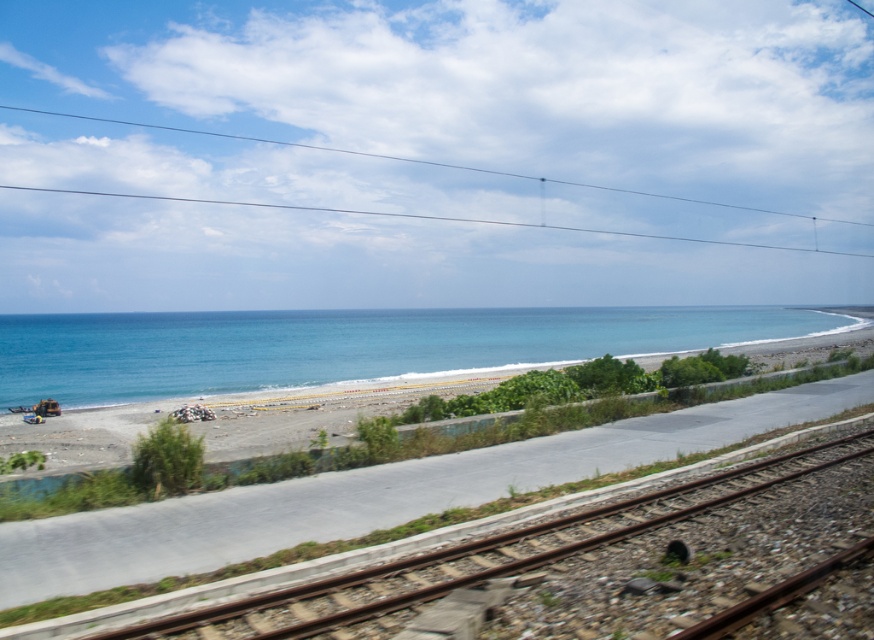
Is smooth sand beach at lower left wider than blue glossy water at left?

No, smooth sand beach at lower left is not wider than blue glossy water at left.

Where is `smooth sand beach at lower left`? smooth sand beach at lower left is located at coordinates (329, 365).

In the scene shown: Which is above, smooth sand beach at lower left or brown rusted metal track at lower center?

smooth sand beach at lower left is above.

Is point (102, 461) in front of point (861, 435)?

No, (102, 461) is further to viewer.

At what (x,y) coordinates should I click in order to perform the action: click on smooth sand beach at lower left. Please return your answer as a coordinate pair (x, y). The height and width of the screenshot is (640, 874). Looking at the image, I should click on pyautogui.click(x=329, y=365).

Does blue glossy water at left come in front of brown rusted metal track at lower center?

No.

Is blue glossy water at left taller than brown rusted metal track at lower center?

Indeed, blue glossy water at left has a greater height compared to brown rusted metal track at lower center.

Is point (373, 339) positioned in front of point (161, 628)?

No, it is not.

The height and width of the screenshot is (640, 874). I want to click on blue glossy water at left, so click(x=345, y=346).